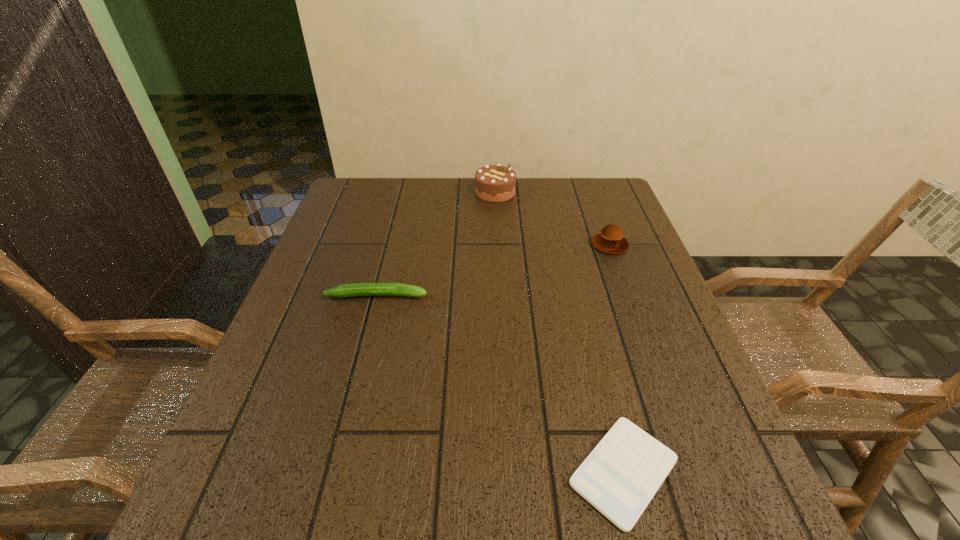
This screenshot has width=960, height=540. Find the location of `free space at the right edge of the desktop`. free space at the right edge of the desktop is located at coordinates (660, 335).

This screenshot has height=540, width=960. In the image, there is a desktop. In order to click on free space at the far right corner in this screenshot , I will do `click(631, 219)`.

This screenshot has height=540, width=960. Identify the location of vacant area that lies between the calculator and the chocolate cake. (560, 332).

Locate an element on the screen. The height and width of the screenshot is (540, 960). vacant area between the third object from right to left and the calculator is located at coordinates (560, 332).

I want to click on empty space that is in between the second tallest object and the zucchini, so click(x=493, y=270).

At what (x,y) coordinates should I click in order to perform the action: click on free spot between the third shortest object and the farthest object. Please return your answer as a coordinate pair (x, y). Looking at the image, I should click on (552, 218).

Where is `free spot between the second object from left to right and the second tallest object`? The image size is (960, 540). free spot between the second object from left to right and the second tallest object is located at coordinates (552, 218).

The height and width of the screenshot is (540, 960). What are the coordinates of `free spot between the chocolate cake and the muffin` in the screenshot? It's located at (552, 218).

At what (x,y) coordinates should I click in order to perform the action: click on free space between the second nearest object and the second tallest object. Please return your answer as a coordinate pair (x, y). This screenshot has height=540, width=960. Looking at the image, I should click on (493, 270).

Find the location of `free space between the third farthest object and the second tallest object`. free space between the third farthest object and the second tallest object is located at coordinates (493, 270).